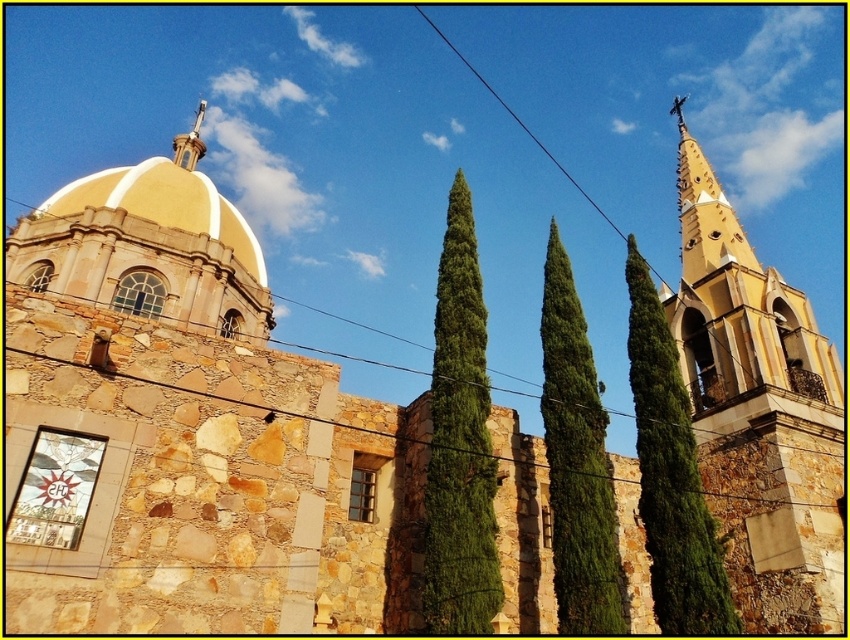
You are standing in front of the historic stone building and want to locate the yellow stucco bell tower at upper right. According to the coordinates provided, where exactly should you look to find it?

The yellow stucco bell tower at upper right is located at point (737, 301).

Based on the photo, you are standing in front of the historic stone building and want to place a small statue between the two points marked as point (667,342) and point (499,100). Which point should the statue be closer to so it is positioned in front of the building?

The statue should be closer to point (667,342) because it is in front of point (499,100), so placing it near the front point ensures it is in front of the building.

You are an architect designing a scale model of this historic building. You need to ensure that the yellow stucco bell tower at upper right and the green textured tree at center are proportionally accurate. Which object should be made larger in your model?

The yellow stucco bell tower at upper right should be made larger in the model since it is larger in size than the green textured tree at center according to the description.